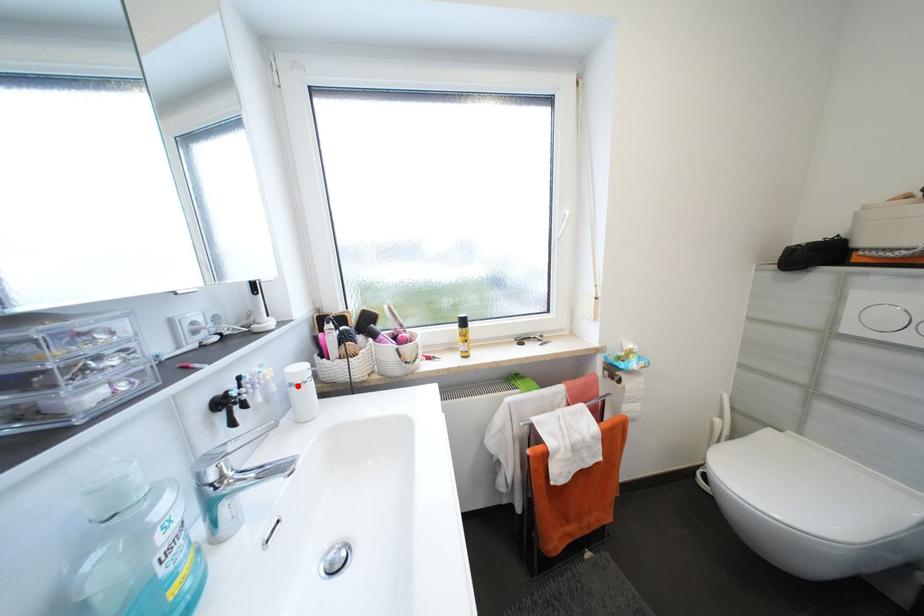
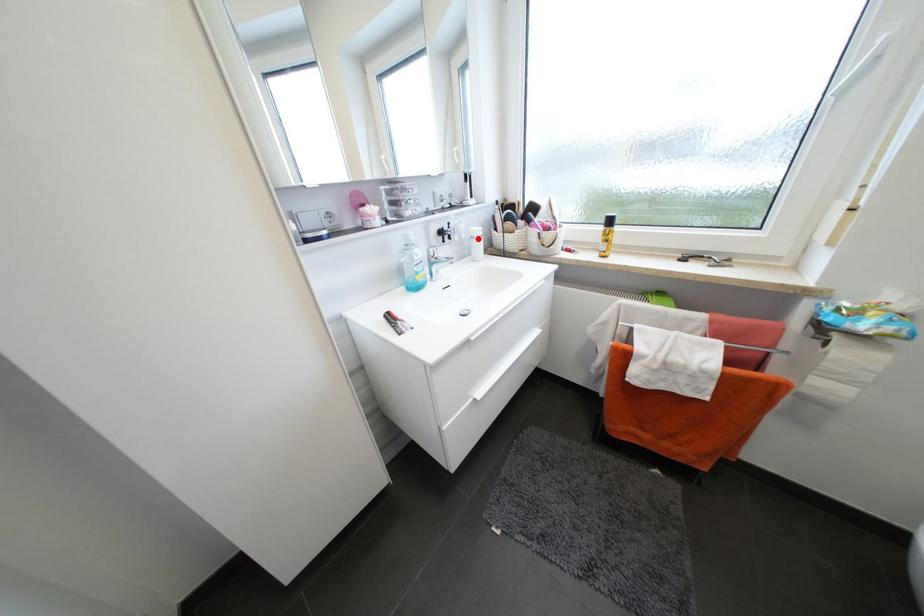
I am providing you with two images of the same scene from different viewpoints. A red point is marked on the first image and another point is marked on the second image. Is the red point in image1 aligned with the point shown in image2?

Yes